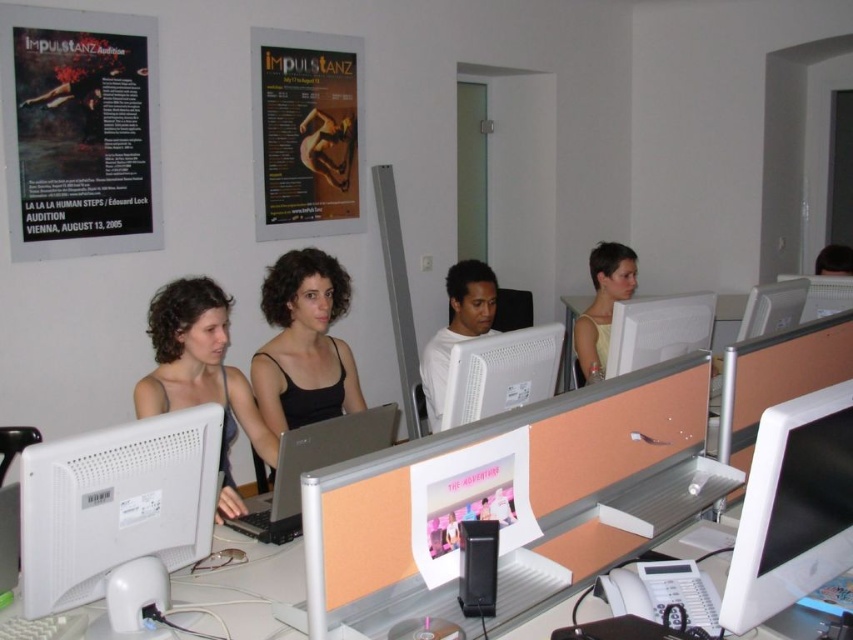
You are sitting at a desk in the computer lab and want to read the matte paper poster at upper center without moving your chair. Can you see it clearly while looking at the white glossy monitor at center?

The matte paper poster at upper center is further to the viewer than the white glossy monitor at center, so you can see it clearly without moving your chair because it is closer to you than the monitor.

You are standing in the computer lab and want to move from point A to point B. Point A is at coordinates point [320,182] and point B is at coordinates point [322,440]. Which point is closer to you?

Point [320,182] is closer to you since it is further to the viewer than point [322,440].

Based on the photo, you are organizing a presentation and need to know which object is narrower between the matte paper poster at upper center and the silver metallic laptop at center. Can you determine this?

The matte paper poster at upper center is narrower than the silver metallic laptop at center, as its width is less than the laptop.